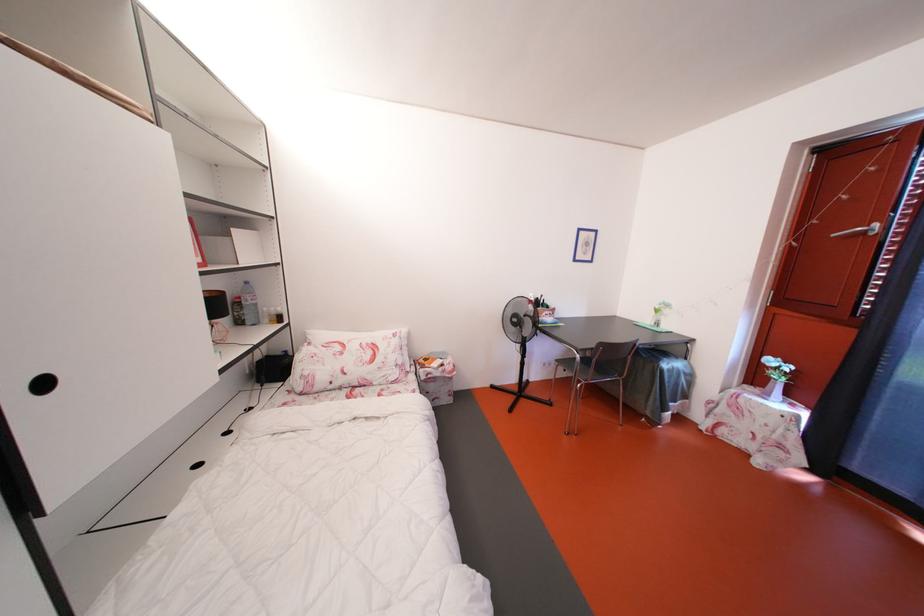
Find where to sit the chair sitting surface. Please return your answer as a coordinate pair (x, y).

(584, 363)